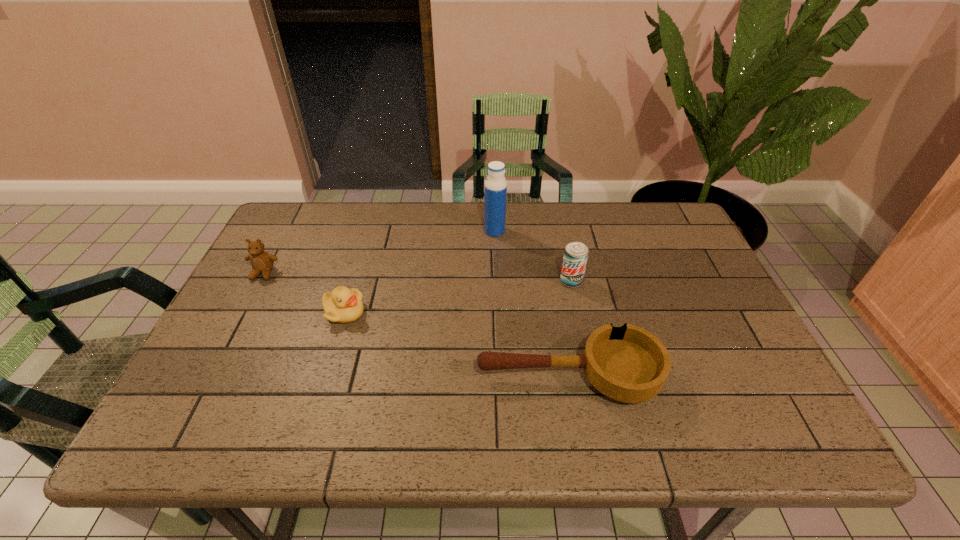
The width and height of the screenshot is (960, 540). Identify the location of free location that satisfies the following two spatial constraints: 1. with the handle on the side of the saucepan; 2. on the front side of the tallest object. (543, 231).

At what (x,y) coordinates should I click in order to perform the action: click on vacant space that satisfies the following two spatial constraints: 1. with the handle on the side of the saucepan; 2. on the front-facing side of the leftmost object. Please return your answer as a coordinate pair (x, y). Looking at the image, I should click on (550, 273).